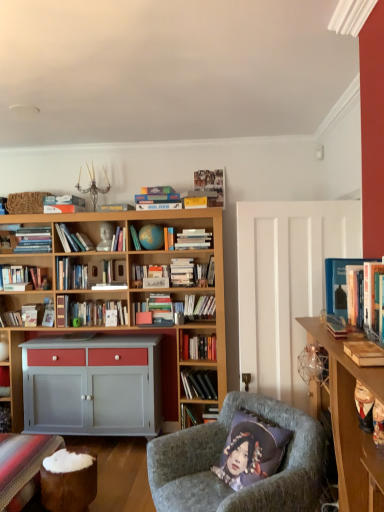
Question: Is point (132, 265) positioned closer to the camera than point (173, 440)?

Choices:
 (A) closer
 (B) farther

Answer: (B)

Question: From their relative heights in the image, would you say hardcover book at center is taller or shorter than velvet grey armchair at center?

Choices:
 (A) short
 (B) tall

Answer: (A)

Question: Which of these objects is positioned farthest from the white matte bookshelf at center, which appears as the 3th book when viewed from the front?

Choices:
 (A) hardcover book at center
 (B) hardcover book at center, arranged as the 6th book when viewed from the back
 (C) wooden carved figurine at right, acting as the first toy starting from the back
 (D) wooden book at right, the 1th book viewed from the front
 (E) shiny plastic toy at right, placed as the second toy when sorted from back to front

Answer: (E)

Question: Which is farther from the hardcover books at center, the eighth book viewed from the front?

Choices:
 (A) white glossy book at center, the 9th book positioned from the front
 (B) wooden desk at right
 (C) hardcover books at center, which is the sixth book in front-to-back order
 (D) teal globe at center
 (E) hardcover book at upper center, which ranks as the 4th book in front-to-back order

Answer: (B)